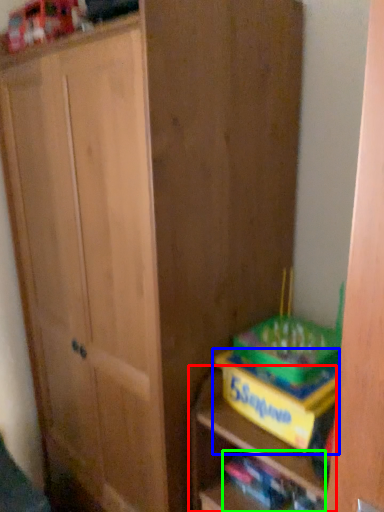
Question: Estimate the real-world distances between objects in this image. Which object is closer to shelf (highlighted by a red box), cabinetry (highlighted by a blue box) or book (highlighted by a green box)?

Choices:
 (A) cabinetry
 (B) book

Answer: (A)